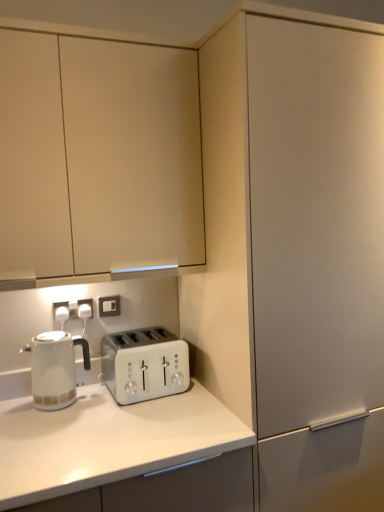
Question: Is point (122, 387) closer or farther from the camera than point (266, 196)?

Choices:
 (A) farther
 (B) closer

Answer: (A)

Question: Is white plastic toaster at center inside or outside of matte white cabinet at center, positioned as the 1th cabinetry in right-to-left order?

Choices:
 (A) inside
 (B) outside

Answer: (B)

Question: Estimate the real-world distances between objects in this image. Which object is farther from the matte white cabinet at upper left, the 2th cabinetry viewed from the right?

Choices:
 (A) white plastic electric outlet at lower left, the second electric outlet in the back-to-front sequence
 (B) white plastic toaster at center
 (C) white plastic electric outlet at upper center, marked as the 1th electric outlet in a back-to-front arrangement
 (D) matte white cabinet at center, positioned as the 1th cabinetry in right-to-left order
 (E) white glossy kettle at left

Answer: (A)

Question: Estimate the real-world distances between objects in this image. Which object is closer to the matte white cabinet at center, positioned as the 1th cabinetry in right-to-left order?

Choices:
 (A) white glossy kettle at left
 (B) white plastic electric outlet at upper center, marked as the 1th electric outlet in a back-to-front arrangement
 (C) matte white cabinet at upper left, the 2th cabinetry viewed from the right
 (D) white plastic toaster at center
 (E) white plastic electric outlet at lower left, arranged as the 2th electric outlet when viewed from the right

Answer: (C)